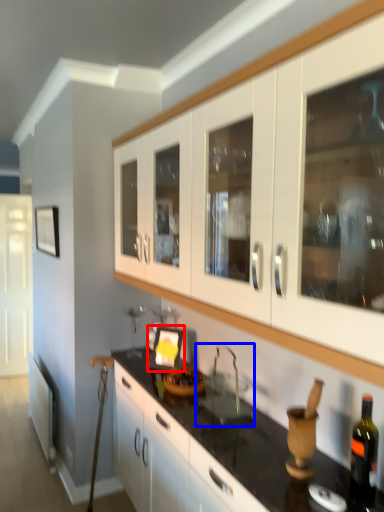
Question: Which of the following is the closest to the observer, picture frame (highlighted by a red box) or sink (highlighted by a blue box)?

Choices:
 (A) picture frame
 (B) sink

Answer: (B)